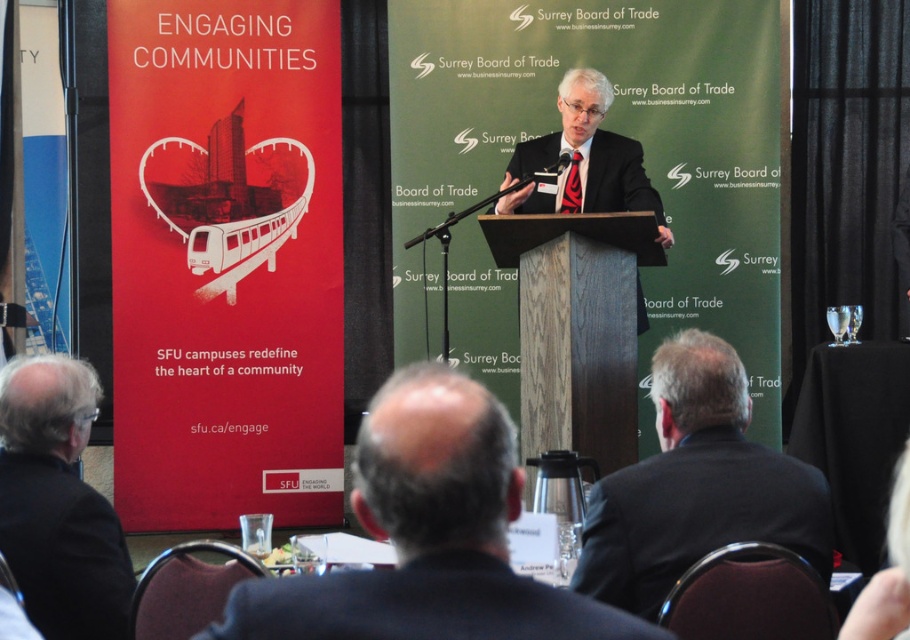
You are a photographer standing at the event. You need to take a photo of the black suit at center. According to the distance, will you need a telephoto lens to capture the entire person in the frame?

The black suit at center is 2.92 meters away from the camera. A telephoto lens is typically used for distant subjects, but at this distance, a standard lens would suffice to capture the entire person without needing to zoom excessively. However, if the photographer is using a very wide angle or requires a tighter shot, a telephoto might be considered. But based on standard photography practices, a telephoto lens isn not necessary here.

You are attending the Surrey Board of Trade event and want to take a photo of the SFU banner on the left side. You are currently standing at point (x=400, y=381). If the camera requires a minimum distance of 2 meters to focus properly, will you be able to take a clear photo?

The distance between point (x=400, y=381) and the camera is 2.15 meters, which is greater than the minimum required 2 meters. Therefore, you can take a clear photo.